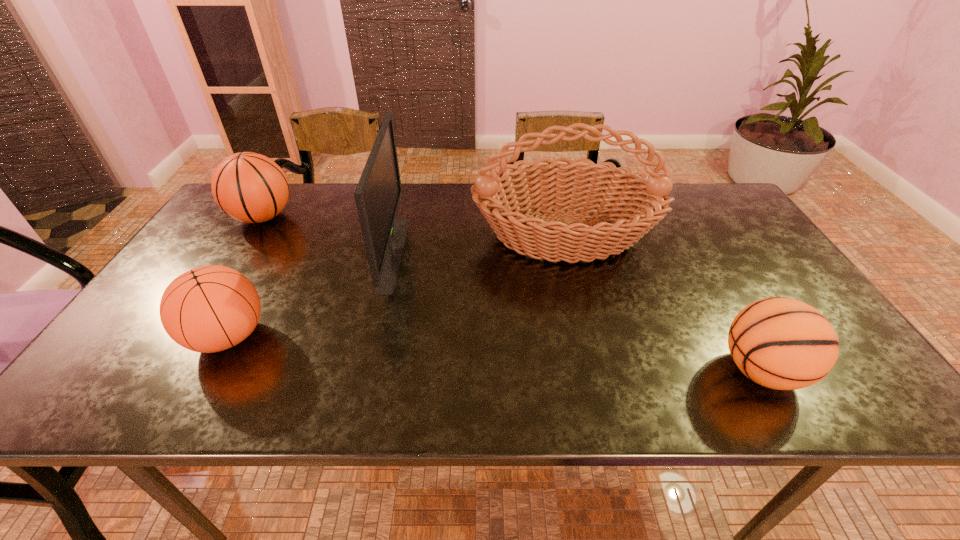
Locate an element on the screen. This screenshot has height=540, width=960. the fourth closest object to the basket is located at coordinates (249, 187).

At what (x,y) coordinates should I click in order to perform the action: click on the closest basketball to the farthest basketball. Please return your answer as a coordinate pair (x, y). The height and width of the screenshot is (540, 960). Looking at the image, I should click on (208, 309).

Identify the location of basketball that is the nearest to the farthest basketball. (208, 309).

You are a GUI agent. You are given a task and a screenshot of the screen. Output one action in this format:
    pyautogui.click(x=<x>, y=<y>)
    Task: Click on the vacant area in the image that satisfies the following two spatial constraints: 1. on the front-facing side of the monitor; 2. on the right side of the rightmost basketball
    The image size is (960, 540).
    Given the screenshot: What is the action you would take?
    click(366, 370)

Locate an element on the screen. This screenshot has height=540, width=960. vacant space that satisfies the following two spatial constraints: 1. on the front-facing side of the third object from left to right; 2. on the right side of the rightmost basketball is located at coordinates (366, 370).

Where is `vacant space that satisfies the following two spatial constraints: 1. on the front-facing side of the third object from left to right; 2. on the right side of the rightmost basketball`? Image resolution: width=960 pixels, height=540 pixels. vacant space that satisfies the following two spatial constraints: 1. on the front-facing side of the third object from left to right; 2. on the right side of the rightmost basketball is located at coordinates (366, 370).